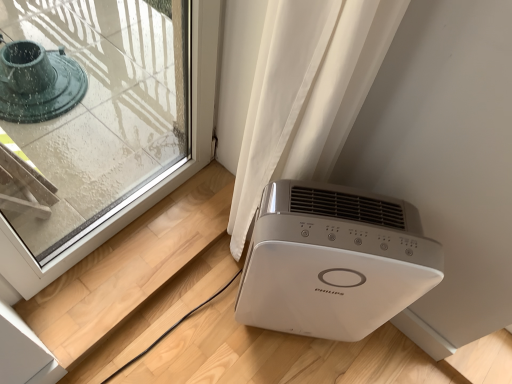
The image size is (512, 384). Identify the location of white plastic air purifier at lower right. (332, 262).

What do you see at coordinates (332, 262) in the screenshot? I see `white plastic air purifier at lower right` at bounding box center [332, 262].

In order to face white plastic air purifier at lower right, should I rotate leftwards or rightwards?

A 8.121 degree turn to the right will do.

You are a GUI agent. You are given a task and a screenshot of the screen. Output one action in this format:
    pyautogui.click(x=<x>, y=<y>)
    Task: Click on the white plastic air purifier at lower right
    Image resolution: width=512 pixels, height=384 pixels.
    Given the screenshot: What is the action you would take?
    pyautogui.click(x=332, y=262)